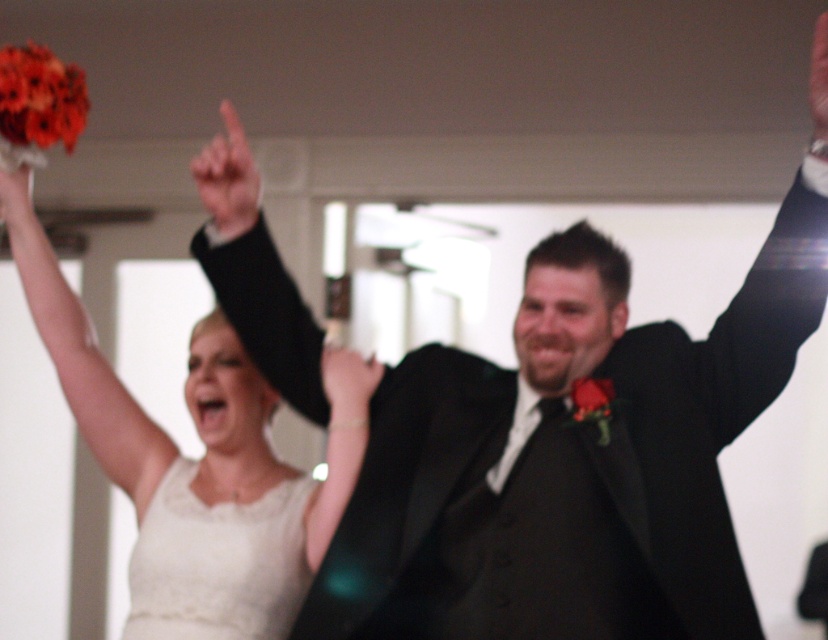
Question: Does black fabric arm at upper right appear on the left side of white matte arm at upper left?

Choices:
 (A) yes
 (B) no

Answer: (B)

Question: Does black satin suit at upper center have a greater width compared to white matte arm at upper left?

Choices:
 (A) yes
 (B) no

Answer: (B)

Question: Estimate the real-world distances between objects in this image. Which object is closer to the white matte arm at upper left?

Choices:
 (A) black satin suit at upper center
 (B) black fabric arm at upper right

Answer: (A)

Question: Observing the image, what is the correct spatial positioning of white matte arm at upper left in reference to white satin bouquet at upper left?

Choices:
 (A) above
 (B) below

Answer: (B)

Question: Which point is farther from the camera taking this photo?

Choices:
 (A) (745, 380)
 (B) (229, 179)
 (C) (188, 385)

Answer: (C)

Question: Which point appears farthest from the camera in this image?

Choices:
 (A) (244, 148)
 (B) (725, 390)

Answer: (A)